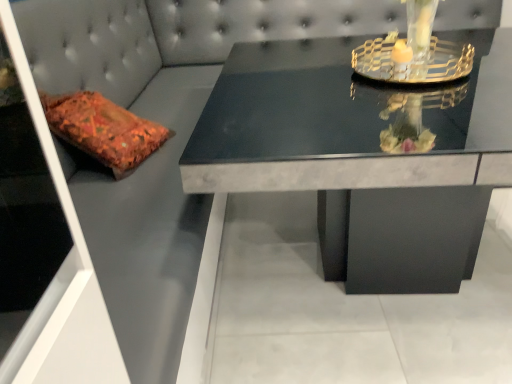
Question: From a real-world perspective, relative to transparent glass door at left, is black marble table at center vertically above or below?

Choices:
 (A) below
 (B) above

Answer: (A)

Question: Does point (455, 180) appear closer or farther from the camera than point (60, 360)?

Choices:
 (A) farther
 (B) closer

Answer: (A)

Question: Estimate the real-world distances between objects in this image. Which object is closer to the clear glass candle holder at upper right?

Choices:
 (A) transparent glass door at left
 (B) black marble table at center

Answer: (B)

Question: Which is farther from the transparent glass door at left?

Choices:
 (A) black marble table at center
 (B) clear glass candle holder at upper right

Answer: (B)